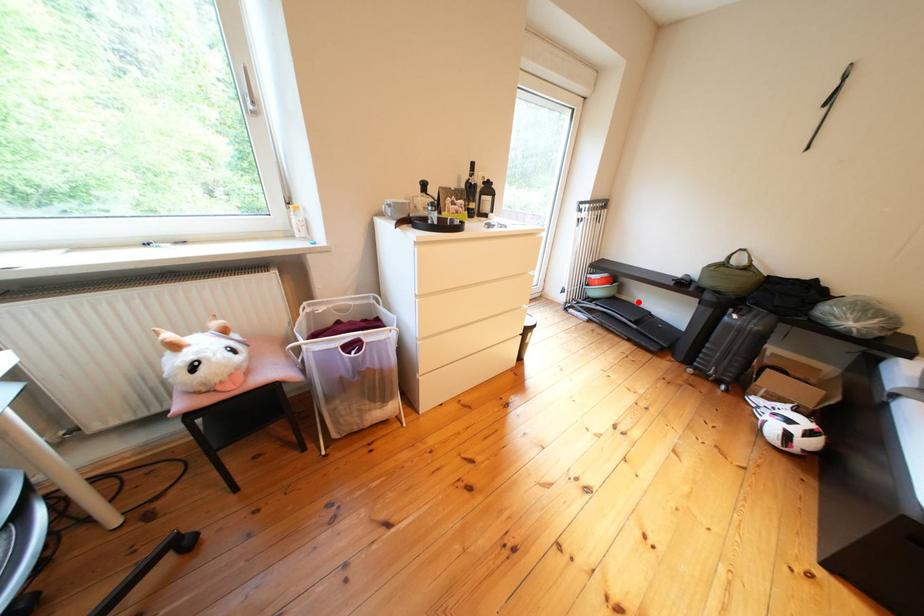
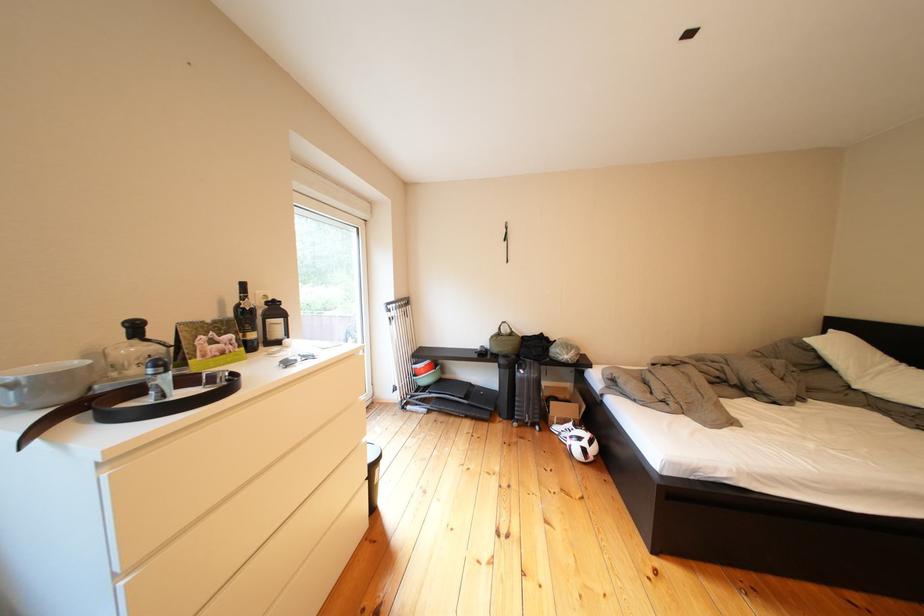
Find the pixel in the second image that matches the highlighted location in the first image.

(462, 381)